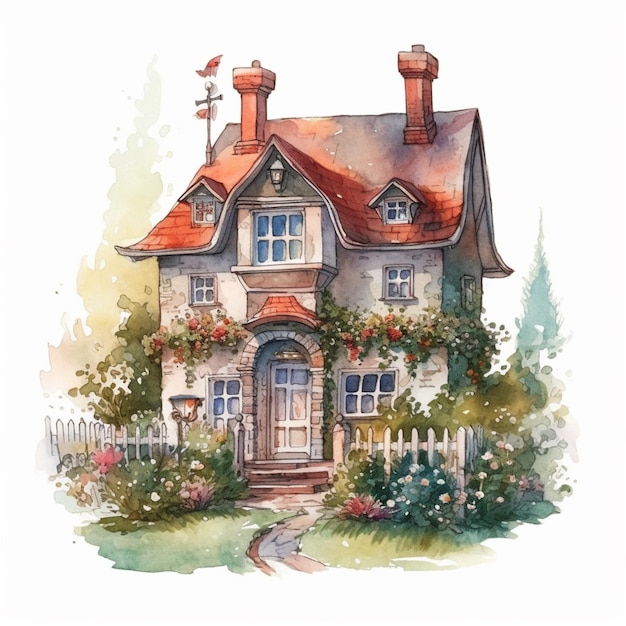
At what (x,y) coordinates should I click in order to perform the action: click on lamp. Please return your answer as a coordinate pair (x, y). Looking at the image, I should click on (188, 413).